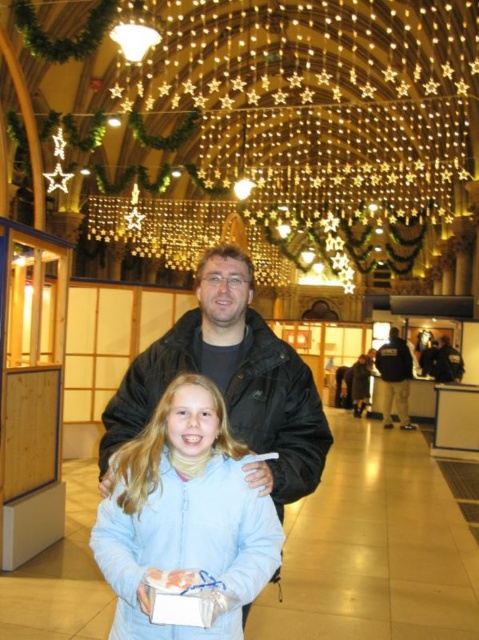
Based on the photo, who is more distant from viewer, (125, 586) or (399, 336)?

The point (399, 336) is more distant.

Locate an element on the screen. The height and width of the screenshot is (640, 479). light blue fabric at center is located at coordinates (184, 515).

This screenshot has height=640, width=479. Describe the element at coordinates (184, 515) in the screenshot. I see `light blue fabric at center` at that location.

Locate an element on the screen. This screenshot has width=479, height=640. light blue fabric at center is located at coordinates (184, 515).